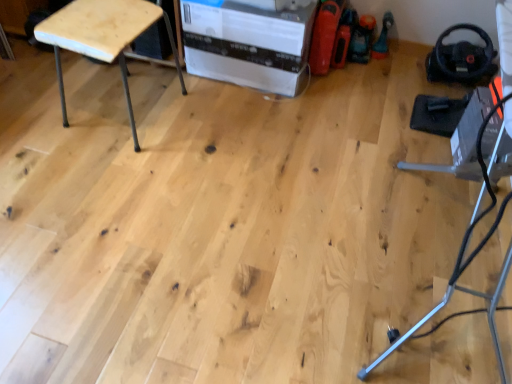
This screenshot has width=512, height=384. Identify the location of blank space to the left of natural wood stool at upper left. (36, 115).